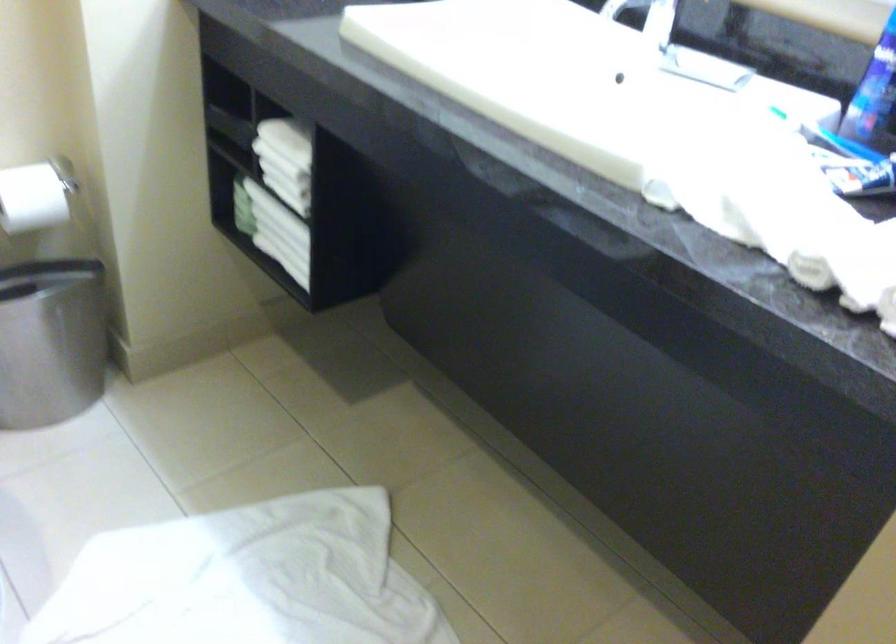
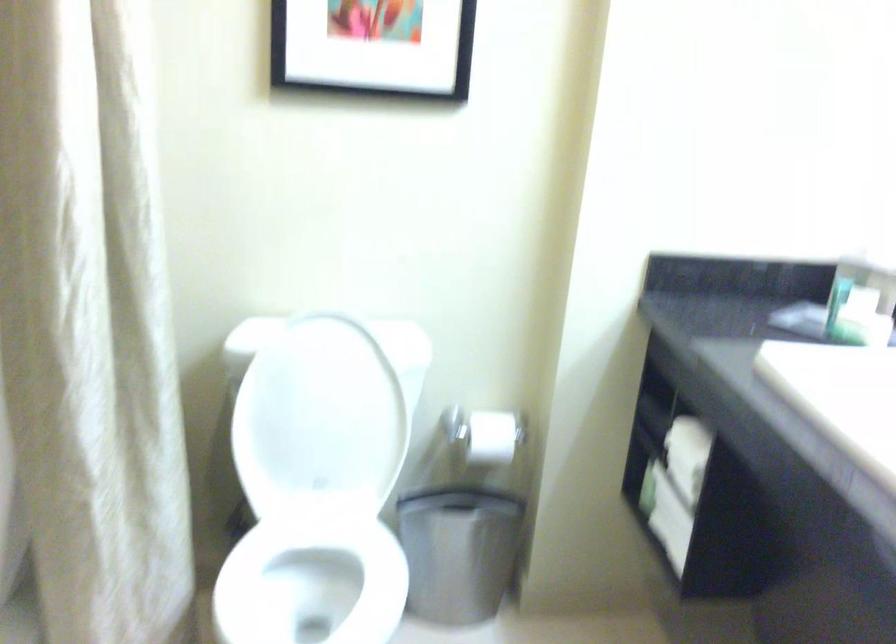
Question: The camera is either moving clockwise (left) or counter-clockwise (right) around the object. The first image is from the beginning of the video and the second image is from the end. Is the camera moving left or right when shooting the video?

Choices:
 (A) Left
 (B) Right

Answer: (B)